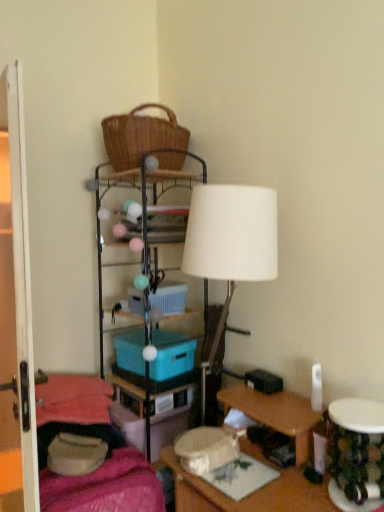
Question: Is blue plastic storage box at center, the second storage box positioned from the bottom, in front of or behind blue plastic storage box at center, arranged as the first storage box when viewed from the top, in the image?

Choices:
 (A) behind
 (B) front

Answer: (B)

Question: In terms of width, does blue plastic storage box at center, the second storage box positioned from the bottom, look wider or thinner when compared to blue plastic storage box at center, arranged as the first storage box when viewed from the top?

Choices:
 (A) wide
 (B) thin

Answer: (A)

Question: Considering the real-world distances, which object is farthest from the transparent glass door at left?

Choices:
 (A) blue plastic storage box at center, the second storage box positioned from the bottom
 (B) wooden desk at lower right
 (C) white matte lamp at center
 (D) woven brown picnic basket at upper center
 (E) camouflage fabric table at lower right

Answer: (E)

Question: Estimate the real-world distances between objects in this image. Which object is farther from the velvet pink blanket at lower left?

Choices:
 (A) blue plastic storage box at center, arranged as the first storage box when viewed from the top
 (B) wooden desk at lower right
 (C) teal plastic storage box at center, which ranks as the 3th storage box in top-to-bottom order
 (D) blue plastic storage box at center, which ranks as the 2th storage box in top-to-bottom order
 (E) white matte lamp at center

Answer: (E)